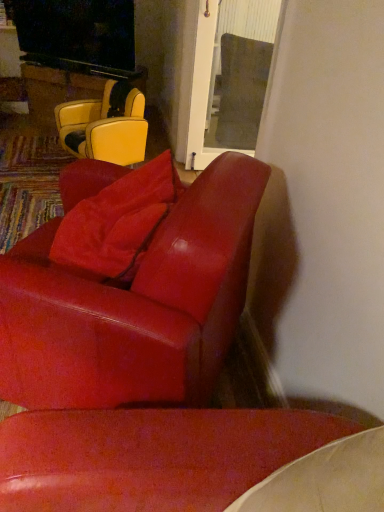
Image resolution: width=384 pixels, height=512 pixels. Describe the element at coordinates (118, 221) in the screenshot. I see `suede-like red pillow at center` at that location.

What do you see at coordinates (58, 89) in the screenshot?
I see `wooden glossy table at upper left` at bounding box center [58, 89].

You are a GUI agent. You are given a task and a screenshot of the screen. Output one action in this format:
    pyautogui.click(x=<x>, y=<y>)
    Task: Click on the leather yellow chair at upper left, which ranks as the 2th chair in front-to-back order
    This screenshot has height=512, width=384.
    Given the screenshot: What is the action you would take?
    pyautogui.click(x=105, y=126)

Find the location of a particular element. This screenshot has width=384, height=512. matte red leather chair at center, arranged as the second chair when viewed from the top is located at coordinates (129, 290).

Which object is positioned more to the right, matte red leather chair at center, positioned as the first chair in bottom-to-top order, or leather yellow chair at upper left, acting as the 1th chair starting from the top?

matte red leather chair at center, positioned as the first chair in bottom-to-top order.

From the image's perspective, which is above, matte red leather chair at center, positioned as the 1th chair in front-to-back order, or leather yellow chair at upper left, acting as the 1th chair starting from the top?

leather yellow chair at upper left, acting as the 1th chair starting from the top, from the image's perspective.

Which of these two, matte red leather chair at center, arranged as the second chair when viewed from the top, or leather yellow chair at upper left, which is the first chair from back to front, is thinner?

Thinner between the two is leather yellow chair at upper left, which is the first chair from back to front.

Would you say matte red leather chair at center, positioned as the first chair in bottom-to-top order, is a long distance from leather yellow chair at upper left, placed as the 2th chair when sorted from bottom to top?

Yes, matte red leather chair at center, positioned as the first chair in bottom-to-top order, and leather yellow chair at upper left, placed as the 2th chair when sorted from bottom to top, are located far from each other.

Which is less distant, (133, 200) or (137, 145)?

The point (133, 200) is in front.

Is suede-like red pillow at center directly adjacent to leather yellow chair at upper left, which ranks as the 2th chair in front-to-back order?

suede-like red pillow at center is not next to leather yellow chair at upper left, which ranks as the 2th chair in front-to-back order, and they're not touching.

Is leather yellow chair at upper left, acting as the 1th chair starting from the top, inside suede-like red pillow at center?

No, leather yellow chair at upper left, acting as the 1th chair starting from the top, is not surrounded by suede-like red pillow at center.

Is suede-like red pillow at center to the left of leather yellow chair at upper left, which ranks as the 2th chair in front-to-back order, from the viewer's perspective?

In fact, suede-like red pillow at center is to the right of leather yellow chair at upper left, which ranks as the 2th chair in front-to-back order.

Does matte red leather chair at center, positioned as the 1th chair in front-to-back order, have a lesser width compared to wooden glossy table at upper left?

No, matte red leather chair at center, positioned as the 1th chair in front-to-back order, is not thinner than wooden glossy table at upper left.

Would you say matte red leather chair at center, arranged as the second chair when viewed from the top, is to the left or to the right of wooden glossy table at upper left in the picture?

Clearly, matte red leather chair at center, arranged as the second chair when viewed from the top, is on the right of wooden glossy table at upper left in the image.

Does matte red leather chair at center, marked as the second chair in a back-to-front arrangement, have a lesser height compared to wooden glossy table at upper left?

No, matte red leather chair at center, marked as the second chair in a back-to-front arrangement, is not shorter than wooden glossy table at upper left.

From the picture: From their relative heights in the image, would you say wooden glossy table at upper left is taller or shorter than matte red leather chair at center, arranged as the second chair when viewed from the top?

Clearly, wooden glossy table at upper left is shorter compared to matte red leather chair at center, arranged as the second chair when viewed from the top.

Which of these two, wooden glossy table at upper left or matte red leather chair at center, positioned as the first chair in bottom-to-top order, is thinner?

Thinner between the two is wooden glossy table at upper left.

From the wooden glossy table at upper left, count 2nd chair to the right and point to it. Please provide its 2D coordinates.

[(129, 290)]

Is wooden glossy table at upper left bigger or smaller than matte red leather chair at center, marked as the second chair in a back-to-front arrangement?

wooden glossy table at upper left is smaller than matte red leather chair at center, marked as the second chair in a back-to-front arrangement.

Consider the image. How different are the orientations of leather yellow chair at upper left, which is the first chair from back to front, and wooden glossy table at upper left in degrees?

They differ by 25.9 degrees in their facing directions.

From the image's perspective, count 1st chairs downward from the wooden glossy table at upper left and point to it. Please provide its 2D coordinates.

[(105, 126)]

Are leather yellow chair at upper left, which is the first chair from back to front, and wooden glossy table at upper left located far from each other?

No.

Considering the relative positions of leather yellow chair at upper left, which ranks as the 2th chair in front-to-back order, and wooden glossy table at upper left in the image provided, is leather yellow chair at upper left, which ranks as the 2th chair in front-to-back order, behind wooden glossy table at upper left?

No, the depth of leather yellow chair at upper left, which ranks as the 2th chair in front-to-back order, is less than that of wooden glossy table at upper left.

Consider the image. In the image, is wooden glossy table at upper left on the left side or the right side of leather yellow chair at upper left, acting as the 1th chair starting from the top?

Based on their positions, wooden glossy table at upper left is located to the left of leather yellow chair at upper left, acting as the 1th chair starting from the top.

Between wooden glossy table at upper left and leather yellow chair at upper left, which is the first chair from back to front, which one has more height?

With more height is leather yellow chair at upper left, which is the first chair from back to front.

From the image's perspective, is wooden glossy table at upper left located beneath leather yellow chair at upper left, placed as the 2th chair when sorted from bottom to top?

No, from the image's perspective, wooden glossy table at upper left is not below leather yellow chair at upper left, placed as the 2th chair when sorted from bottom to top.

Is wooden glossy table at upper left turned away from leather yellow chair at upper left, which is the first chair from back to front?

No, wooden glossy table at upper left is not facing the opposite direction of leather yellow chair at upper left, which is the first chair from back to front.

Find the location of `pillow that is above the wooden glossy table at upper left (from a real-world perspective)`. pillow that is above the wooden glossy table at upper left (from a real-world perspective) is located at coordinates (118, 221).

Based on the photo, is wooden glossy table at upper left directly adjacent to suede-like red pillow at center?

No, wooden glossy table at upper left is not in contact with suede-like red pillow at center.

Who is smaller, wooden glossy table at upper left or suede-like red pillow at center?

suede-like red pillow at center.

Would you say wooden glossy table at upper left is outside suede-like red pillow at center?

wooden glossy table at upper left lies outside suede-like red pillow at center's area.

Identify the location of chair in front of the leather yellow chair at upper left, acting as the 1th chair starting from the top. The height and width of the screenshot is (512, 384). (129, 290).

Locate an element on the screen. Image resolution: width=384 pixels, height=512 pixels. the 2nd chair to the left of the suede-like red pillow at center, counting from the anchor's position is located at coordinates (105, 126).

Which object lies nearer to the anchor point matte red leather chair at center, arranged as the second chair when viewed from the top, leather yellow chair at upper left, which ranks as the 2th chair in front-to-back order, or suede-like red pillow at center?

Based on the image, suede-like red pillow at center appears to be nearer to matte red leather chair at center, arranged as the second chair when viewed from the top.

From the image, which object appears to be farther from matte red leather chair at center, positioned as the 1th chair in front-to-back order, suede-like red pillow at center or wooden glossy table at upper left?

Among the two, wooden glossy table at upper left is located further to matte red leather chair at center, positioned as the 1th chair in front-to-back order.

When comparing their distances from matte red leather chair at center, arranged as the second chair when viewed from the top, does wooden glossy table at upper left or leather yellow chair at upper left, which ranks as the 2th chair in front-to-back order, seem further?

wooden glossy table at upper left lies further to matte red leather chair at center, arranged as the second chair when viewed from the top, than the other object.

When comparing their distances from suede-like red pillow at center, does leather yellow chair at upper left, which is the first chair from back to front, or matte red leather chair at center, marked as the second chair in a back-to-front arrangement, seem closer?

matte red leather chair at center, marked as the second chair in a back-to-front arrangement, lies closer to suede-like red pillow at center than the other object.

Based on their spatial positions, is leather yellow chair at upper left, which ranks as the 2th chair in front-to-back order, or wooden glossy table at upper left further from suede-like red pillow at center?

Among the two, wooden glossy table at upper left is located further to suede-like red pillow at center.

Which object lies nearer to the anchor point suede-like red pillow at center, matte red leather chair at center, marked as the second chair in a back-to-front arrangement, or wooden glossy table at upper left?

matte red leather chair at center, marked as the second chair in a back-to-front arrangement, lies closer to suede-like red pillow at center than the other object.

Which object lies nearer to the anchor point wooden glossy table at upper left, leather yellow chair at upper left, acting as the 1th chair starting from the top, or suede-like red pillow at center?

leather yellow chair at upper left, acting as the 1th chair starting from the top, is positioned closer to the anchor wooden glossy table at upper left.

Which object lies further to the anchor point wooden glossy table at upper left, matte red leather chair at center, marked as the second chair in a back-to-front arrangement, or suede-like red pillow at center?

Based on the image, matte red leather chair at center, marked as the second chair in a back-to-front arrangement, appears to be further to wooden glossy table at upper left.

This screenshot has width=384, height=512. In order to click on pillow between matte red leather chair at center, marked as the second chair in a back-to-front arrangement, and leather yellow chair at upper left, acting as the 1th chair starting from the top, along the z-axis in this screenshot , I will do `click(118, 221)`.

Identify the location of pillow between matte red leather chair at center, marked as the second chair in a back-to-front arrangement, and wooden glossy table at upper left from front to back. (118, 221).

This screenshot has height=512, width=384. I want to click on chair between matte red leather chair at center, arranged as the second chair when viewed from the top, and wooden glossy table at upper left, along the z-axis, so click(105, 126).

Find the location of a particular element. The width and height of the screenshot is (384, 512). chair located between suede-like red pillow at center and wooden glossy table at upper left in the depth direction is located at coordinates (105, 126).